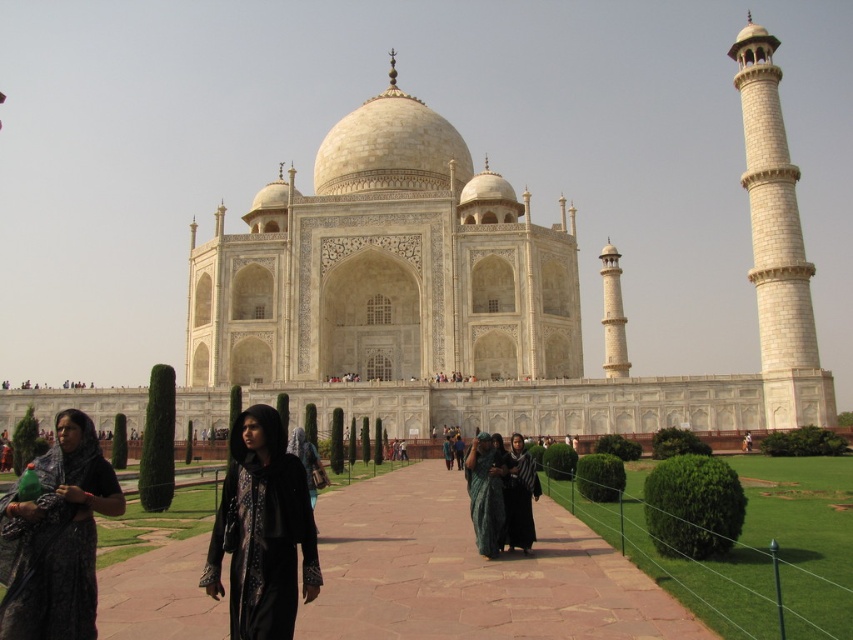
You are standing at the entrance of the Taj Mahal complex and see the black velvet dress at center. If you walk straight towards the Taj Mahal, will the dress be in your path?

The black velvet dress at center is located at point (262,531). Since the paved pathway leads straight towards the Taj Mahal and the dress is centrally positioned, walking straight would place the dress directly in your path.

You are a fashion designer attending an event at the Taj Mahal. You brought two outfits to choose from. The black velvet dress at center and the dark gray fabric at center. Which outfit would you choose if you want to wear the smaller one?

The black velvet dress at center has a smaller size compared to dark gray fabric at center, so you should choose the black velvet dress at center.